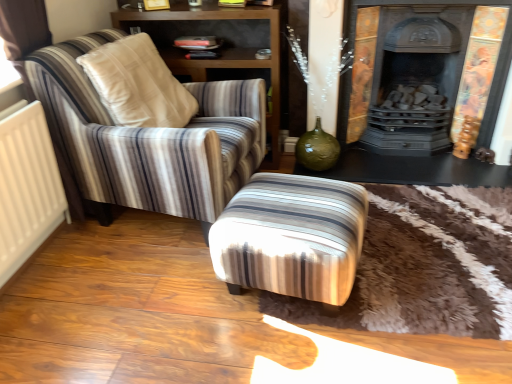
At what (x,y) coordinates should I click in order to perform the action: click on unoccupied area in front of black glossy table at lower right. Please return your answer as a coordinate pair (x, y). This screenshot has height=384, width=512. Looking at the image, I should click on (424, 239).